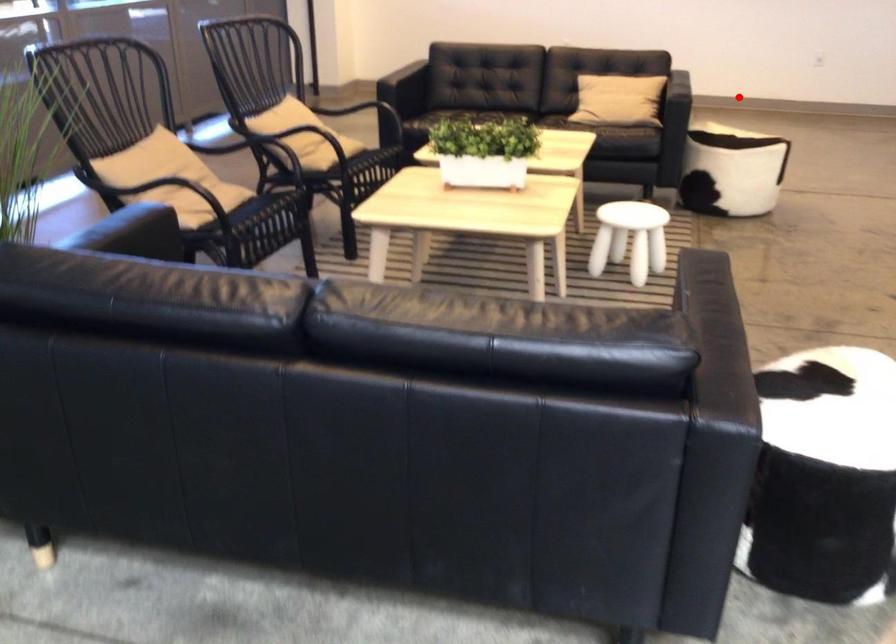
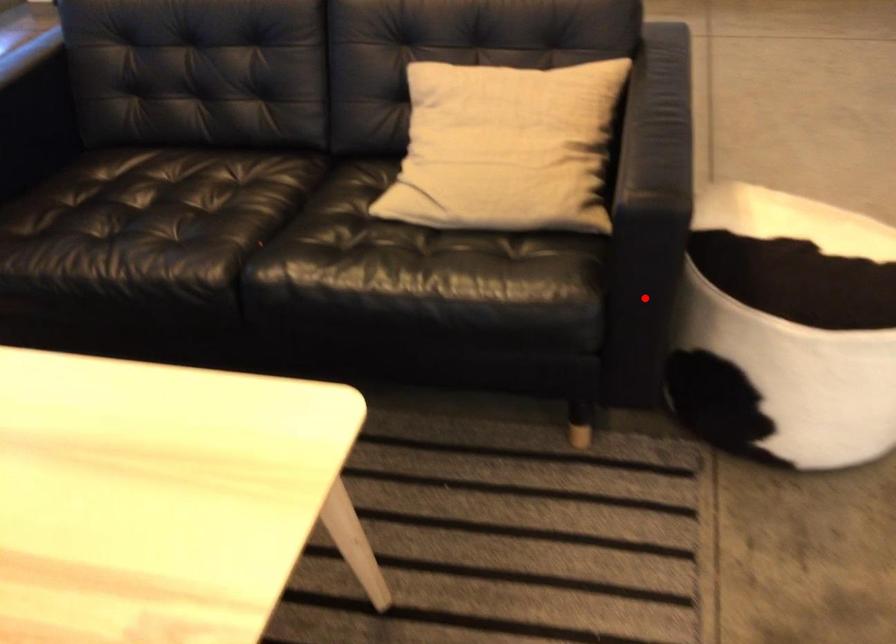
I am providing you with two images of the same scene from different viewpoints. A red point is marked on the first image and another point is marked on the second image. Does the point marked in image1 correspond to the same location as the one in image2?

No